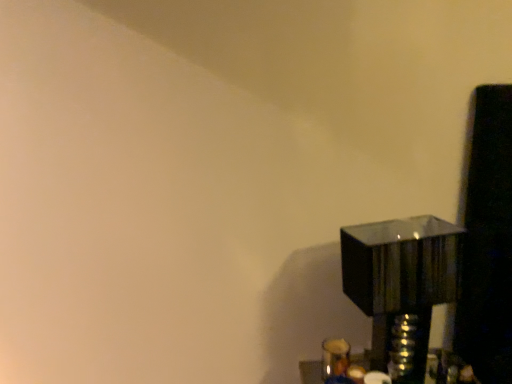
The height and width of the screenshot is (384, 512). What are the coordinates of `metallic silver lamp at right` in the screenshot? It's located at (401, 285).

The height and width of the screenshot is (384, 512). What do you see at coordinates (401, 285) in the screenshot?
I see `metallic silver lamp at right` at bounding box center [401, 285].

Measure the distance between point (414, 283) and camera.

Point (414, 283) and camera are 3.57 feet apart from each other.

This screenshot has width=512, height=384. Find the location of `metallic silver lamp at right`. metallic silver lamp at right is located at coordinates 401,285.